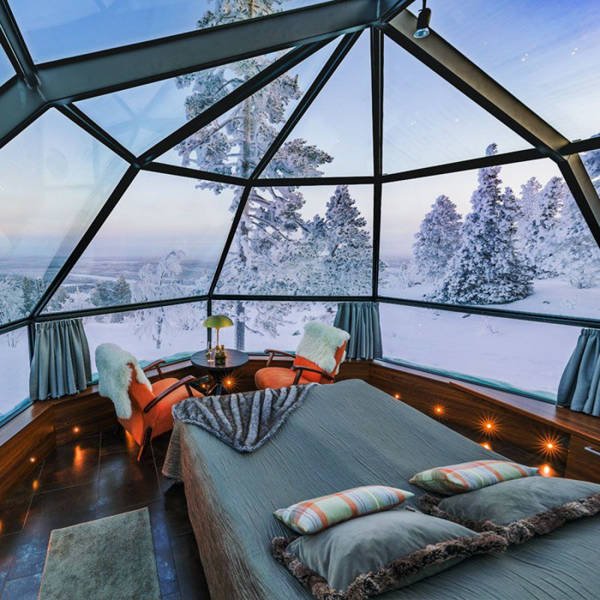
Find the location of `grey pillow`. grey pillow is located at coordinates (409, 527).